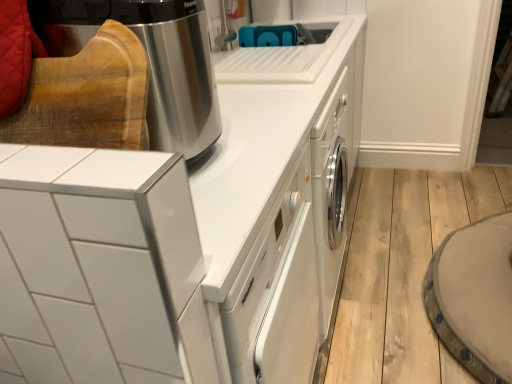
In order to face stainless steel coffee maker at upper left, the first home appliance positioned from the top, should I rotate leftwards or rightwards?

To align with it, rotate left about 18.618°.

The width and height of the screenshot is (512, 384). What are the coordinates of `white glossy dishwasher at center, arranged as the 1th home appliance when ordered from the bottom` in the screenshot? It's located at (182, 244).

Which is more to the right, white glossy cabinet at upper left, the 2th home appliance when ordered from top to bottom, or stainless steel coffee maker at upper left, the first home appliance positioned from the top?

stainless steel coffee maker at upper left, the first home appliance positioned from the top, is more to the right.

Looking at the image, does white glossy cabinet at upper left, which ranks as the 2th home appliance in bottom-to-top order, seem bigger or smaller compared to stainless steel coffee maker at upper left, the first home appliance positioned from the top?

Considering their sizes, white glossy cabinet at upper left, which ranks as the 2th home appliance in bottom-to-top order, takes up more space than stainless steel coffee maker at upper left, the first home appliance positioned from the top.

Would you say white glossy cabinet at upper left, the 2th home appliance when ordered from top to bottom, is outside stainless steel coffee maker at upper left, the first home appliance positioned from the top?

Yes, white glossy cabinet at upper left, the 2th home appliance when ordered from top to bottom, is not within stainless steel coffee maker at upper left, the first home appliance positioned from the top.

Is stainless steel coffee maker at upper left, the first home appliance positioned from the top, completely or partially outside of white glossy dishwasher at center, which is counted as the third home appliance, starting from the top?

stainless steel coffee maker at upper left, the first home appliance positioned from the top, lies outside white glossy dishwasher at center, which is counted as the third home appliance, starting from the top,'s area.

Which object is closer to the camera, stainless steel coffee maker at upper left, which ranks as the 3th home appliance in bottom-to-top order, or white glossy dishwasher at center, arranged as the 1th home appliance when ordered from the bottom?

white glossy dishwasher at center, arranged as the 1th home appliance when ordered from the bottom, is more forward.

Considering the sizes of stainless steel coffee maker at upper left, the first home appliance positioned from the top, and white glossy dishwasher at center, arranged as the 1th home appliance when ordered from the bottom, in the image, is stainless steel coffee maker at upper left, the first home appliance positioned from the top, taller or shorter than white glossy dishwasher at center, arranged as the 1th home appliance when ordered from the bottom,?

In the image, stainless steel coffee maker at upper left, the first home appliance positioned from the top, appears to be shorter than white glossy dishwasher at center, arranged as the 1th home appliance when ordered from the bottom.

From the picture: Can you confirm if stainless steel coffee maker at upper left, which ranks as the 3th home appliance in bottom-to-top order, is bigger than white glossy dishwasher at center, arranged as the 1th home appliance when ordered from the bottom?

No.

From the image's perspective, which is above, white glossy dishwasher at center, arranged as the 1th home appliance when ordered from the bottom, or stainless steel coffee maker at upper left, the first home appliance positioned from the top?

stainless steel coffee maker at upper left, the first home appliance positioned from the top.

Is white glossy dishwasher at center, which is counted as the third home appliance, starting from the top, thinner than stainless steel coffee maker at upper left, the first home appliance positioned from the top?

Incorrect, the width of white glossy dishwasher at center, which is counted as the third home appliance, starting from the top, is not less than that of stainless steel coffee maker at upper left, the first home appliance positioned from the top.

Can you confirm if white glossy dishwasher at center, arranged as the 1th home appliance when ordered from the bottom, is smaller than stainless steel coffee maker at upper left, which ranks as the 3th home appliance in bottom-to-top order?

No.

Between point (242, 239) and point (156, 216), which one is positioned in front?

Point (156, 216)

Between white glossy dishwasher at center, which is counted as the third home appliance, starting from the top, and white glossy cabinet at upper left, which ranks as the 2th home appliance in bottom-to-top order, which one has larger width?

Wider between the two is white glossy dishwasher at center, which is counted as the third home appliance, starting from the top.

Relative to white glossy cabinet at upper left, the 2th home appliance when ordered from top to bottom, is white glossy dishwasher at center, arranged as the 1th home appliance when ordered from the bottom, in front or behind?

Clearly, white glossy dishwasher at center, arranged as the 1th home appliance when ordered from the bottom, is behind white glossy cabinet at upper left, the 2th home appliance when ordered from top to bottom.

Which of these two, white glossy dishwasher at center, arranged as the 1th home appliance when ordered from the bottom, or white glossy cabinet at upper left, which ranks as the 2th home appliance in bottom-to-top order, stands shorter?

Standing shorter between the two is white glossy cabinet at upper left, which ranks as the 2th home appliance in bottom-to-top order.

From the image's perspective, is white glossy cabinet at upper left, which ranks as the 2th home appliance in bottom-to-top order, above white glossy dishwasher at center, which is counted as the third home appliance, starting from the top?

Correct, white glossy cabinet at upper left, which ranks as the 2th home appliance in bottom-to-top order, appears higher than white glossy dishwasher at center, which is counted as the third home appliance, starting from the top, in the image.

Is white glossy cabinet at upper left, the 2th home appliance when ordered from top to bottom, oriented towards white glossy dishwasher at center, arranged as the 1th home appliance when ordered from the bottom?

No, white glossy cabinet at upper left, the 2th home appliance when ordered from top to bottom, is not turned towards white glossy dishwasher at center, arranged as the 1th home appliance when ordered from the bottom.

Which is more to the left, white glossy cabinet at upper left, the 2th home appliance when ordered from top to bottom, or white glossy dishwasher at center, arranged as the 1th home appliance when ordered from the bottom?

white glossy cabinet at upper left, the 2th home appliance when ordered from top to bottom.

Is white glossy cabinet at upper left, the 2th home appliance when ordered from top to bottom, far away from white glossy dishwasher at center, which is counted as the third home appliance, starting from the top?

No, white glossy cabinet at upper left, the 2th home appliance when ordered from top to bottom, is not far away from white glossy dishwasher at center, which is counted as the third home appliance, starting from the top.

From the image's perspective, which one is positioned lower, stainless steel coffee maker at upper left, the first home appliance positioned from the top, or white glossy cabinet at upper left, which ranks as the 2th home appliance in bottom-to-top order?

white glossy cabinet at upper left, which ranks as the 2th home appliance in bottom-to-top order, is shown below in the image.

Considering their positions, is stainless steel coffee maker at upper left, the first home appliance positioned from the top, located in front of or behind white glossy cabinet at upper left, the 2th home appliance when ordered from top to bottom?

stainless steel coffee maker at upper left, the first home appliance positioned from the top, is behind white glossy cabinet at upper left, the 2th home appliance when ordered from top to bottom.

From a real-world perspective, is stainless steel coffee maker at upper left, which ranks as the 3th home appliance in bottom-to-top order, positioned above or below white glossy cabinet at upper left, which ranks as the 2th home appliance in bottom-to-top order?

From a real-world perspective, stainless steel coffee maker at upper left, which ranks as the 3th home appliance in bottom-to-top order, is physically above white glossy cabinet at upper left, which ranks as the 2th home appliance in bottom-to-top order.

Can you tell me how much stainless steel coffee maker at upper left, which ranks as the 3th home appliance in bottom-to-top order, and white glossy cabinet at upper left, the 2th home appliance when ordered from top to bottom, differ in facing direction?

90.3 degrees.

You are a GUI agent. You are given a task and a screenshot of the screen. Output one action in this format:
    pyautogui.click(x=<x>, y=<y>)
    Task: Click on the 2nd home appliance behind the white glossy cabinet at upper left, which ranks as the 2th home appliance in bottom-to-top order, counting from the anchor's position
    The width and height of the screenshot is (512, 384).
    Given the screenshot: What is the action you would take?
    pyautogui.click(x=150, y=61)

The width and height of the screenshot is (512, 384). I want to click on home appliance that is the 2nd object above the white glossy dishwasher at center, which is counted as the third home appliance, starting from the top (from a real-world perspective), so click(150, 61).

Estimate the real-world distances between objects in this image. Which object is further from white glossy cabinet at upper left, which ranks as the 2th home appliance in bottom-to-top order, white glossy dishwasher at center, arranged as the 1th home appliance when ordered from the bottom, or stainless steel coffee maker at upper left, the first home appliance positioned from the top?

Based on the image, stainless steel coffee maker at upper left, the first home appliance positioned from the top, appears to be further to white glossy cabinet at upper left, which ranks as the 2th home appliance in bottom-to-top order.

Which object lies further to the anchor point white glossy dishwasher at center, arranged as the 1th home appliance when ordered from the bottom, white glossy cabinet at upper left, which ranks as the 2th home appliance in bottom-to-top order, or stainless steel coffee maker at upper left, the first home appliance positioned from the top?

Among the two, stainless steel coffee maker at upper left, the first home appliance positioned from the top, is located further to white glossy dishwasher at center, arranged as the 1th home appliance when ordered from the bottom.

Looking at the image, which one is located closer to white glossy cabinet at upper left, which ranks as the 2th home appliance in bottom-to-top order, stainless steel coffee maker at upper left, the first home appliance positioned from the top, or white glossy dishwasher at center, which is counted as the third home appliance, starting from the top?

The object closer to white glossy cabinet at upper left, which ranks as the 2th home appliance in bottom-to-top order, is white glossy dishwasher at center, which is counted as the third home appliance, starting from the top.

Which object lies further to the anchor point white glossy dishwasher at center, which is counted as the third home appliance, starting from the top, stainless steel coffee maker at upper left, which ranks as the 3th home appliance in bottom-to-top order, or white glossy cabinet at upper left, the 2th home appliance when ordered from top to bottom?

stainless steel coffee maker at upper left, which ranks as the 3th home appliance in bottom-to-top order.

Considering their positions, is white glossy dishwasher at center, which is counted as the third home appliance, starting from the top, positioned further to stainless steel coffee maker at upper left, the first home appliance positioned from the top, than white glossy cabinet at upper left, which ranks as the 2th home appliance in bottom-to-top order?

white glossy cabinet at upper left, which ranks as the 2th home appliance in bottom-to-top order, lies further to stainless steel coffee maker at upper left, the first home appliance positioned from the top, than the other object.

When comparing their distances from stainless steel coffee maker at upper left, the first home appliance positioned from the top, does white glossy cabinet at upper left, the 2th home appliance when ordered from top to bottom, or white glossy dishwasher at center, arranged as the 1th home appliance when ordered from the bottom, seem closer?

white glossy dishwasher at center, arranged as the 1th home appliance when ordered from the bottom, lies closer to stainless steel coffee maker at upper left, the first home appliance positioned from the top, than the other object.

You are a GUI agent. You are given a task and a screenshot of the screen. Output one action in this format:
    pyautogui.click(x=<x>, y=<y>)
    Task: Click on the home appliance between stainless steel coffee maker at upper left, the first home appliance positioned from the top, and white glossy dishwasher at center, which is counted as the third home appliance, starting from the top, in the up-down direction
    The height and width of the screenshot is (384, 512).
    Given the screenshot: What is the action you would take?
    pyautogui.click(x=104, y=263)